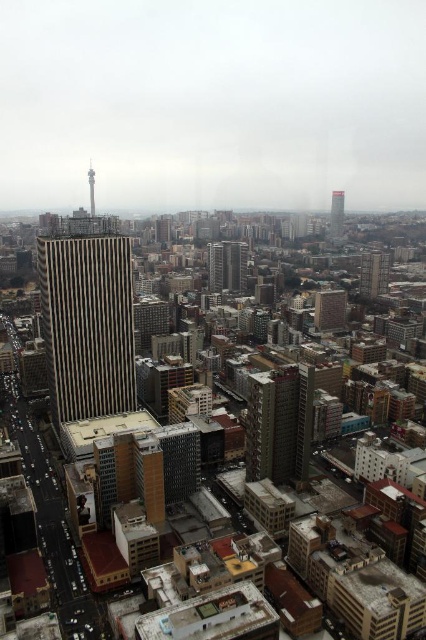
Question: Considering the relative positions of green glass skyscraper at center and gray concrete tower at center in the image provided, where is green glass skyscraper at center located with respect to gray concrete tower at center?

Choices:
 (A) left
 (B) right

Answer: (B)

Question: Is gold striped building at center closer to the viewer compared to green glass skyscraper at center?

Choices:
 (A) yes
 (B) no

Answer: (A)

Question: Which point is farther to the camera?

Choices:
 (A) (91, 214)
 (B) (235, 259)
 (C) (86, 413)
 (D) (385, 280)

Answer: (A)

Question: Which object is positioned farthest from the greenish-gray concrete building at upper right?

Choices:
 (A) green glass skyscraper at center
 (B) smooth glass skyscraper at upper center

Answer: (A)

Question: Which point is farther from the camera taking this photo?

Choices:
 (A) (218, 256)
 (B) (342, 220)

Answer: (B)

Question: Is green glass skyscraper at center to the left of greenish-gray concrete building at upper right from the viewer's perspective?

Choices:
 (A) no
 (B) yes

Answer: (B)